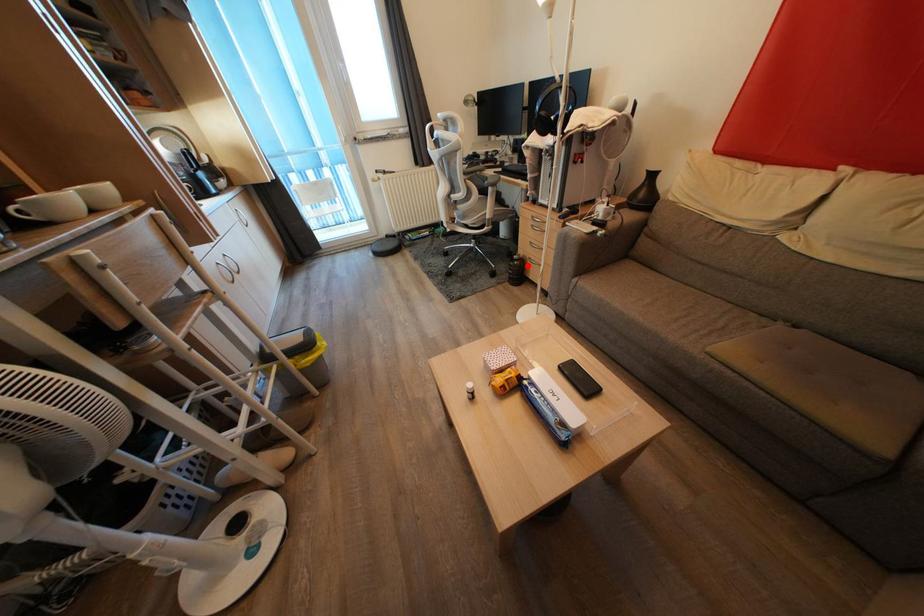
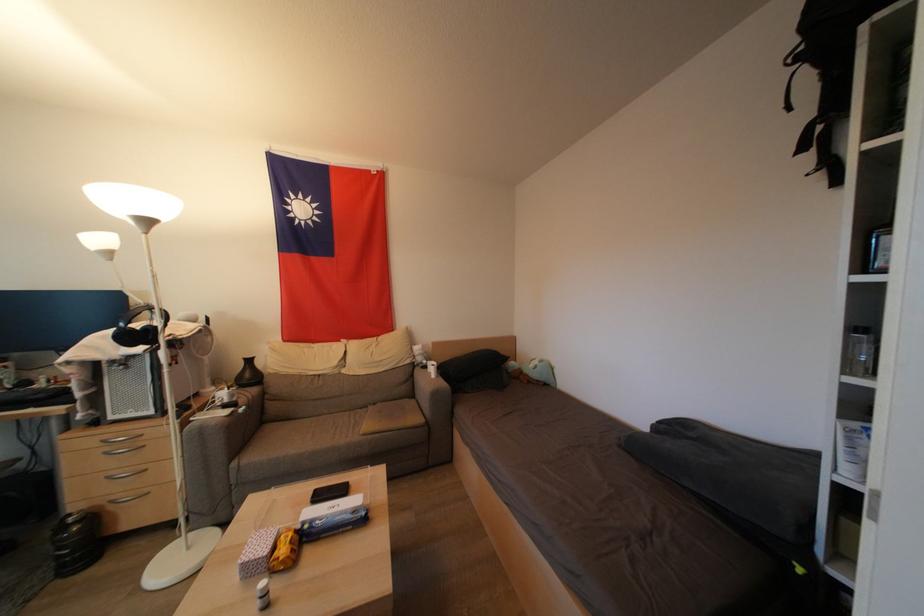
Question: I am providing you with two images of the same scene from different viewpoints. Given a red point in image1, look at the same physical point in image2. Is it:

Choices:
 (A) Closer to the viewpoint
 (B) Farther from the viewpoint

Answer: (A)